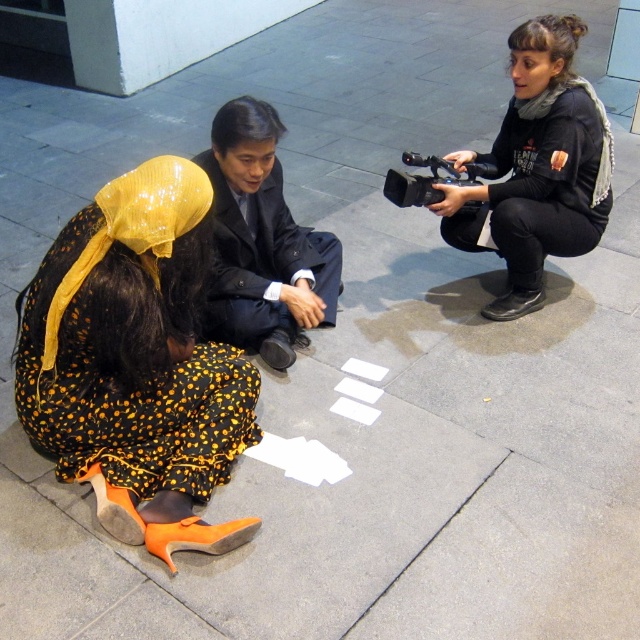
Question: Which is nearer to the black glossy suit at center?

Choices:
 (A) orange fabric dress at lower left
 (B) black matte camera at center

Answer: (A)

Question: Which point is closer to the camera?

Choices:
 (A) (256, 340)
 (B) (129, 276)

Answer: (B)

Question: Is orange fabric dress at lower left smaller than black glossy suit at center?

Choices:
 (A) no
 (B) yes

Answer: (A)

Question: Is orange fabric dress at lower left closer to the viewer compared to black matte camera at center?

Choices:
 (A) no
 (B) yes

Answer: (B)

Question: Is black matte camera at center to the right of black glossy suit at center from the viewer's perspective?

Choices:
 (A) no
 (B) yes

Answer: (B)

Question: Which point appears farthest from the camera in this image?

Choices:
 (A) (252, 154)
 (B) (230, 358)
 (C) (545, 70)

Answer: (C)